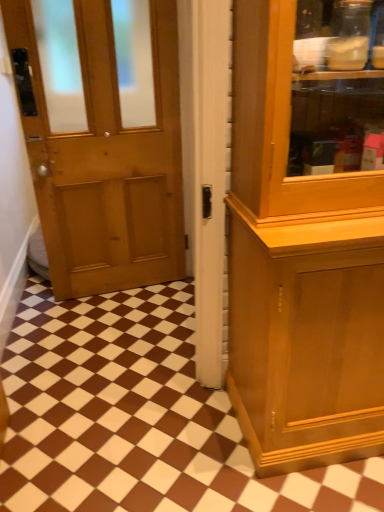
This screenshot has width=384, height=512. In order to click on vacant space to the right of matte wood door at center in this screenshot , I will do `click(189, 416)`.